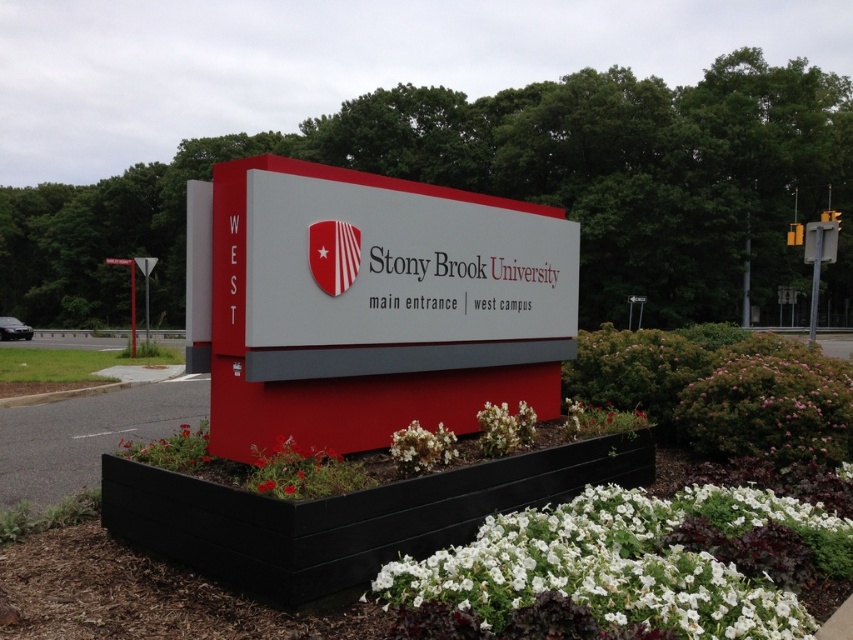
You are a gardener planning to plant a new bush that requires a space of 1.5 meters in diameter. You see the pink matte bush at lower right and the white matte flower at lower center. Which existing plant has enough space to accommodate the new bush?

The pink matte bush at lower right is bigger than the white matte flower at lower center, so the pink matte bush at lower right has enough space to accommodate the new bush.

You are standing at the main entrance of Stony Brook University. You see the pink matte bush at lower right. Can you reach it without moving from your current position?

The pink matte bush at lower right is 18.64 feet away from you, so you cannot reach it without moving from your current position.